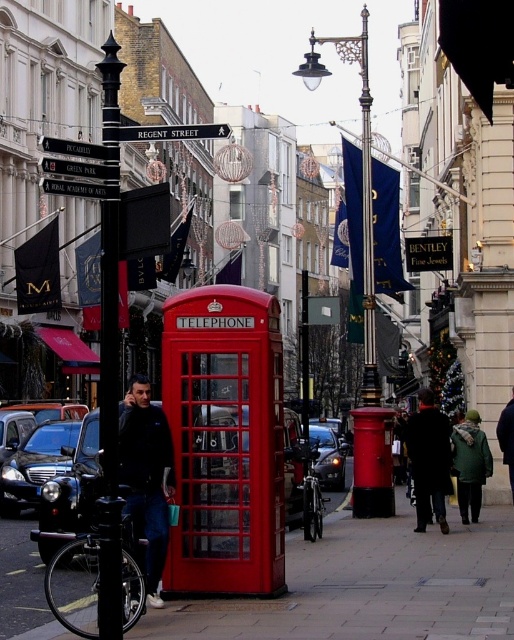
You are a tourist standing in front of the classic red telephone box and want to put your dark wool coat at center somewhere. Where should you place it?

You should place the dark wool coat at center at the coordinates point (429,460).

You are a delivery person carrying a large box that is 1 meter wide. You need to walk through the narrow alley between the dark wool coat at center and the metallic silver street sign at center. Can your box fit through the space between them?

The dark wool coat at center is narrower than the metallic silver street sign at center. However, the combined width of both objects isn not provided, so it is unclear if the 1 meter wide box can fit through the space between them. More information is needed to determine this.